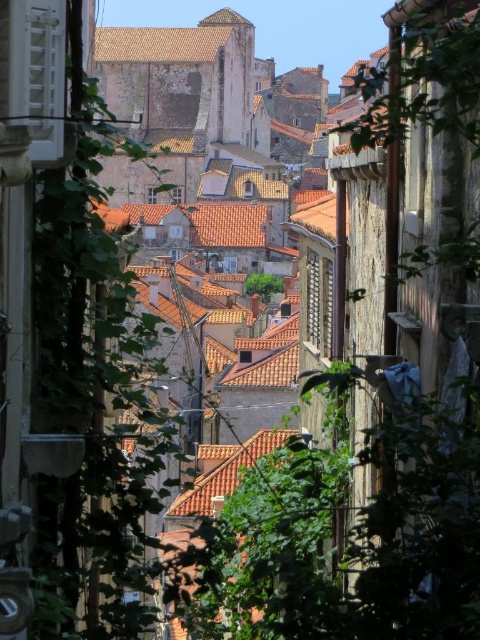
Question: Estimate the real-world distances between objects in this image. Which object is closer to the brown tiled roofs at center?

Choices:
 (A) terracotta tiled roof at center
 (B) brown textured roof at upper center

Answer: (B)

Question: From the image, what is the correct spatial relationship of brown tiled roofs at center in relation to terracotta tiled roof at center?

Choices:
 (A) above
 (B) below

Answer: (A)

Question: Which object is farther from the camera taking this photo?

Choices:
 (A) brown textured roof at upper center
 (B) terracotta tiled roof at center
 (C) brown tiled roofs at center

Answer: (A)

Question: Which of the following is the closest to the observer?

Choices:
 (A) terracotta tiled roof at center
 (B) brown textured roof at upper center

Answer: (A)

Question: From the image, what is the correct spatial relationship of brown textured roof at upper center in relation to terracotta tiled roof at center?

Choices:
 (A) above
 (B) below

Answer: (A)

Question: Can you confirm if brown textured roof at upper center is positioned to the right of terracotta tiled roof at center?

Choices:
 (A) yes
 (B) no

Answer: (B)